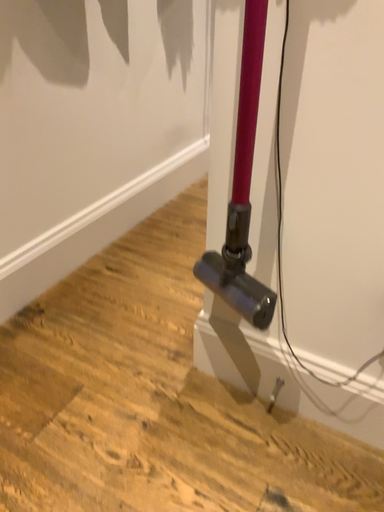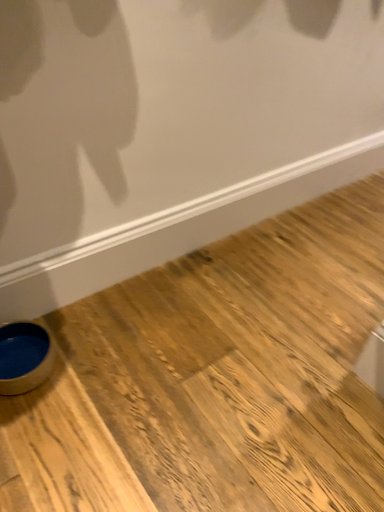
Question: How did the camera likely rotate when shooting the video?

Choices:
 (A) rotated right
 (B) rotated left

Answer: (B)